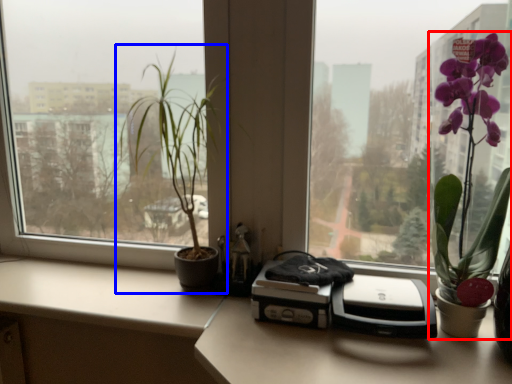
Question: Among these objects, which one is nearest to the camera, houseplant (highlighted by a red box) or houseplant (highlighted by a blue box)?

Choices:
 (A) houseplant
 (B) houseplant

Answer: (A)